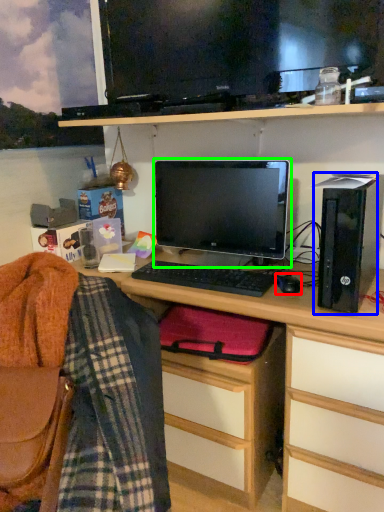
Question: Estimate the real-world distances between objects in this image. Which object is closer to mouse (highlighted by a red box), computer tower (highlighted by a blue box) or computer monitor (highlighted by a green box)?

Choices:
 (A) computer tower
 (B) computer monitor

Answer: (A)